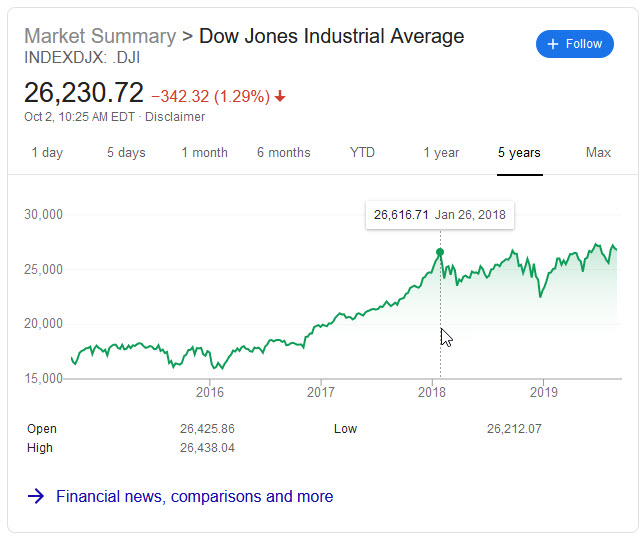
In order to click on mouse in this screenshot , I will do `click(443, 333)`.